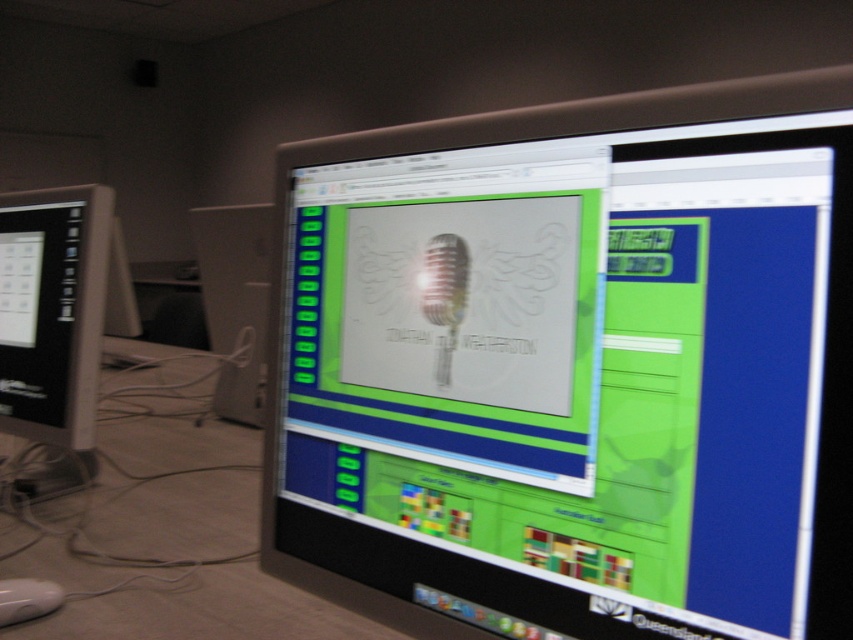
Can you confirm if matte black monitor at left is thinner than white plastic mouse at lower left?

No, matte black monitor at left is not thinner than white plastic mouse at lower left.

Is matte black monitor at left further to the viewer compared to white plastic mouse at lower left?

Yes, it is.

This screenshot has width=853, height=640. Describe the element at coordinates (53, 323) in the screenshot. I see `matte black monitor at left` at that location.

Locate an element on the screen. The image size is (853, 640). matte black monitor at left is located at coordinates (53, 323).

Is matte black monitor at center positioned behind white plastic computer tower at center-left?

That is False.

Who is more distant from viewer, [264,531] or [248,280]?

The point [248,280] is more distant.

This screenshot has height=640, width=853. What do you see at coordinates (572, 368) in the screenshot?
I see `matte black monitor at center` at bounding box center [572, 368].

At what (x,y) coordinates should I click in order to perform the action: click on matte black monitor at center. Please return your answer as a coordinate pair (x, y). Looking at the image, I should click on (572, 368).

Image resolution: width=853 pixels, height=640 pixels. What do you see at coordinates (572, 368) in the screenshot?
I see `matte black monitor at center` at bounding box center [572, 368].

Does matte black monitor at center have a lesser height compared to white plastic mouse at lower left?

Incorrect, matte black monitor at center's height does not fall short of white plastic mouse at lower left's.

This screenshot has width=853, height=640. Describe the element at coordinates (572, 368) in the screenshot. I see `matte black monitor at center` at that location.

Where is `matte black monitor at center`? This screenshot has width=853, height=640. matte black monitor at center is located at coordinates (572, 368).